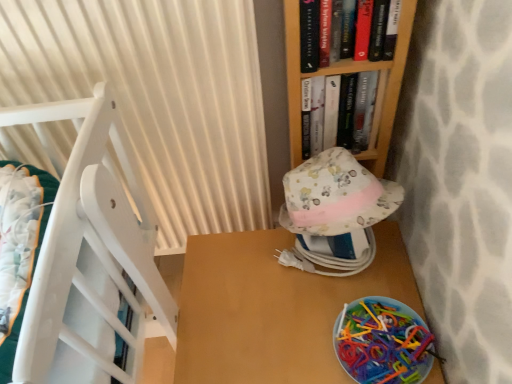
At what (x,y) coordinates should I click in order to perform the action: click on vacant space positioned to the left of translucent plastic toys at lower right. Please return your answer as a coordinate pair (x, y). This screenshot has width=512, height=384. Looking at the image, I should click on (286, 329).